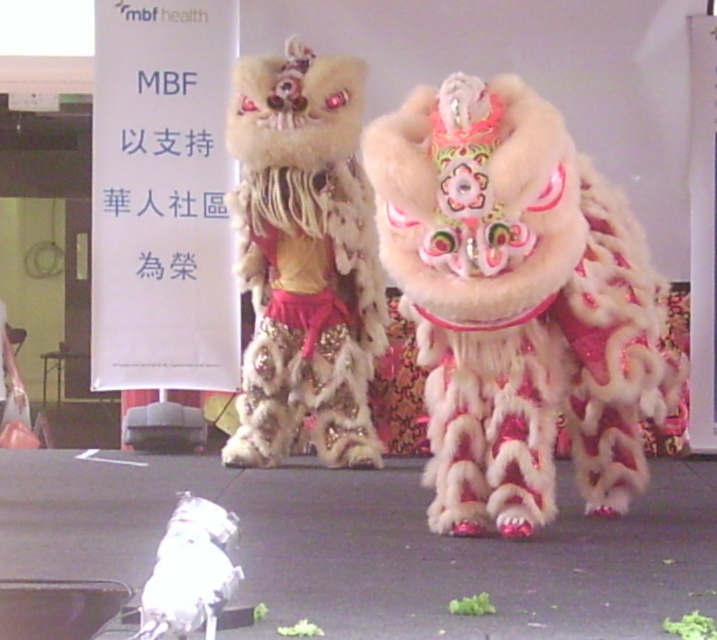
Question: Does fuzzy white lion at center have a greater width compared to white fluffy cat at lower left?

Choices:
 (A) yes
 (B) no

Answer: (A)

Question: Is fuzzy white lion at center smaller than white fluffy cat at lower left?

Choices:
 (A) yes
 (B) no

Answer: (B)

Question: Is fuzzy white lion at center to the right of fuzzy beige lion at center from the viewer's perspective?

Choices:
 (A) no
 (B) yes

Answer: (B)

Question: Among these objects, which one is nearest to the camera?

Choices:
 (A) white fluffy cat at lower left
 (B) fuzzy white lion at center

Answer: (A)

Question: Which point is closer to the camera?

Choices:
 (A) (186, 616)
 (B) (626, 333)
 (C) (328, 228)

Answer: (A)

Question: Which point is closer to the camera?

Choices:
 (A) fuzzy beige lion at center
 (B) fuzzy white lion at center
 (C) white fluffy cat at lower left

Answer: (C)